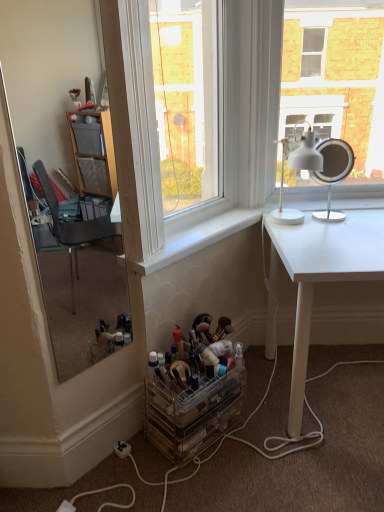
Image resolution: width=384 pixels, height=512 pixels. I want to click on blank space above white smooth window sill at center (from a real-world perspective), so click(x=193, y=231).